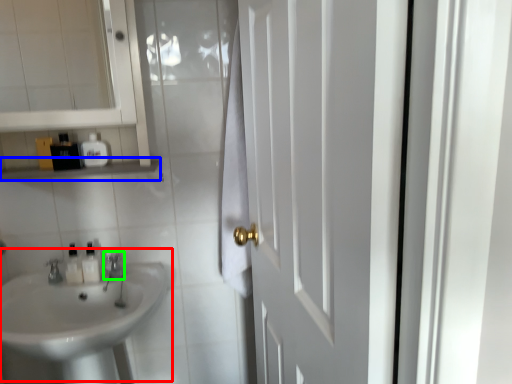
Question: Which object is the closest to the sink (highlighted by a red box)? Choose among these: balustrade (highlighted by a blue box) or faucet (highlighted by a green box).

Choices:
 (A) balustrade
 (B) faucet

Answer: (B)